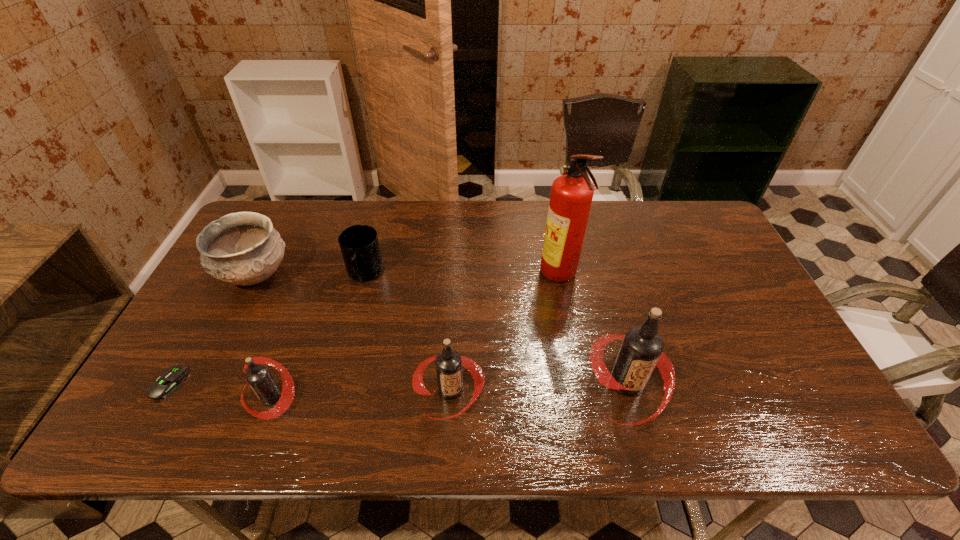
Locate an element on the screen. The width and height of the screenshot is (960, 540). pottery that is at the left edge is located at coordinates 243,248.

The image size is (960, 540). Find the location of `computer mouse located at the left edge`. computer mouse located at the left edge is located at coordinates (170, 379).

This screenshot has width=960, height=540. Identify the location of object that is at the near left corner. (170, 379).

The image size is (960, 540). What are the coordinates of `vacant space at the far edge of the desktop` in the screenshot? It's located at (599, 205).

At what (x,y) coordinates should I click in order to perform the action: click on free space at the left edge. Please return your answer as a coordinate pair (x, y). Looking at the image, I should click on (238, 305).

Identify the location of free space at the far left corner. The width and height of the screenshot is (960, 540). (280, 204).

Find the location of a particular element. This screenshot has width=960, height=540. free location at the far right corner of the desktop is located at coordinates (687, 210).

Find the location of a particular element. This screenshot has height=540, width=960. free space that is in between the shortest object and the tallest object is located at coordinates (364, 330).

Where is `vacant space in between the pottery and the rightmost root beer`? This screenshot has width=960, height=540. vacant space in between the pottery and the rightmost root beer is located at coordinates (442, 329).

This screenshot has height=540, width=960. Find the location of `vacant area that lies between the computer mouse and the second tallest root beer`. vacant area that lies between the computer mouse and the second tallest root beer is located at coordinates (309, 387).